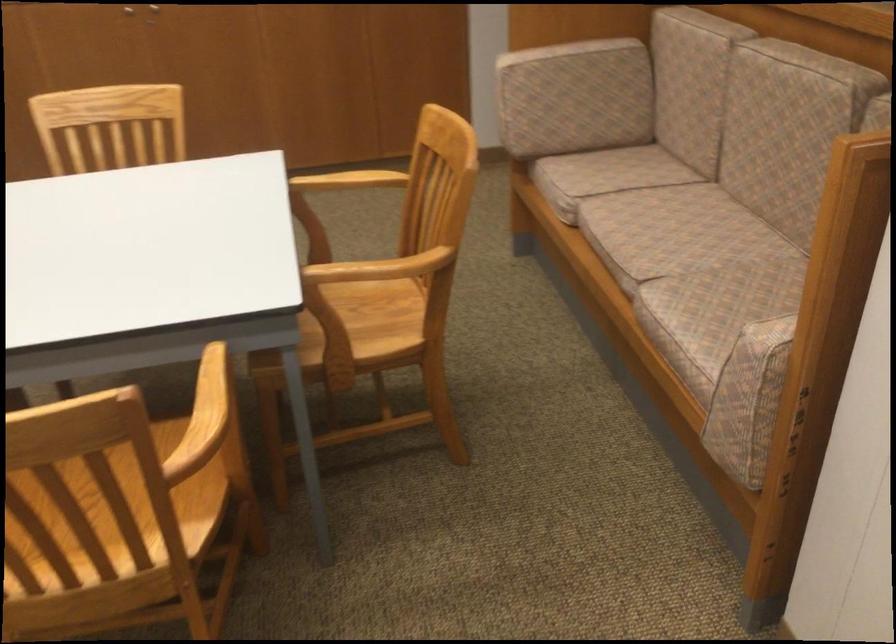
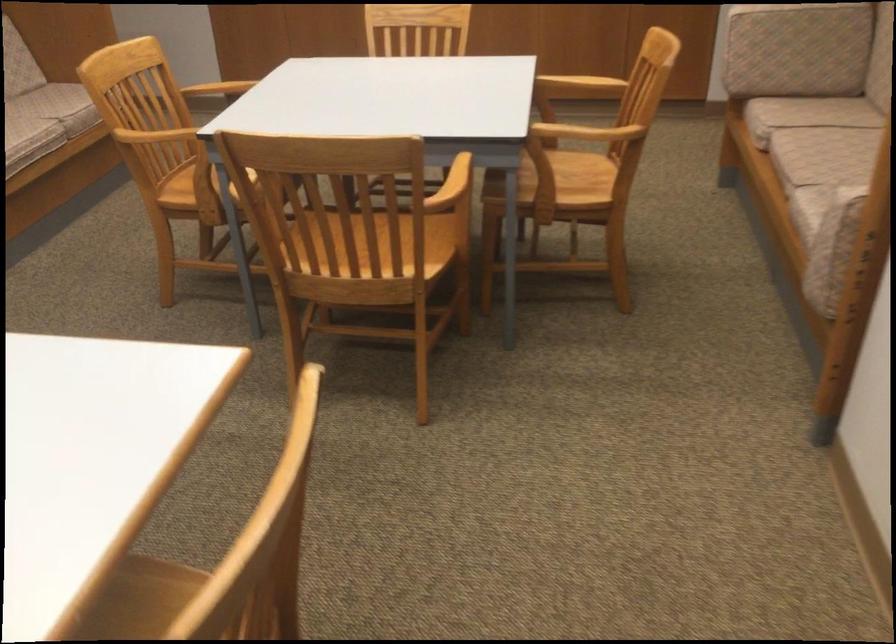
Find the pixel in the second image that matches (81,564) in the first image.

(358, 259)